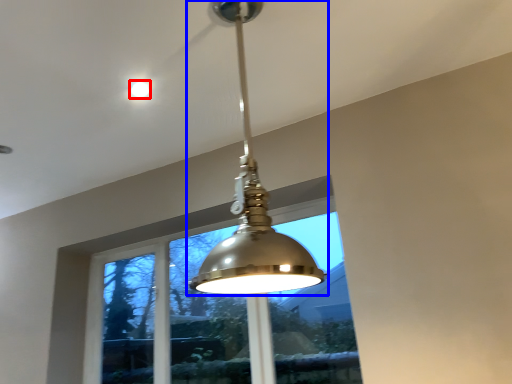
Question: Which object appears farthest to the camera in this image, droplight (highlighted by a red box) or lamp (highlighted by a blue box)?

Choices:
 (A) droplight
 (B) lamp

Answer: (A)